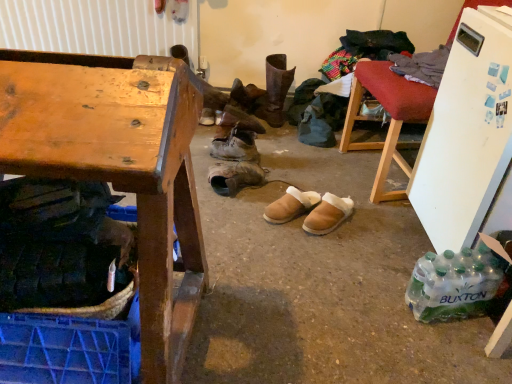
Question: Does wooden desk at left have a smaller size compared to wooden chair at upper right?

Choices:
 (A) yes
 (B) no

Answer: (B)

Question: Is wooden desk at left positioned in front of wooden chair at upper right?

Choices:
 (A) yes
 (B) no

Answer: (A)

Question: Does wooden desk at left have a greater width compared to wooden chair at upper right?

Choices:
 (A) yes
 (B) no

Answer: (A)

Question: From a real-world perspective, is wooden desk at left located higher than wooden chair at upper right?

Choices:
 (A) no
 (B) yes

Answer: (A)

Question: Is wooden desk at left surrounding wooden chair at upper right?

Choices:
 (A) yes
 (B) no

Answer: (B)

Question: From a real-world perspective, is wooden desk at left positioned above or below clear plastic bottles at lower right?

Choices:
 (A) below
 (B) above

Answer: (B)

Question: In terms of size, does wooden desk at left appear bigger or smaller than clear plastic bottles at lower right?

Choices:
 (A) big
 (B) small

Answer: (A)

Question: Is wooden desk at left in front of or behind clear plastic bottles at lower right in the image?

Choices:
 (A) behind
 (B) front

Answer: (B)

Question: Is wooden desk at left to the left or to the right of clear plastic bottles at lower right in the image?

Choices:
 (A) right
 (B) left

Answer: (B)

Question: Would you say leather boots at center, which is the third footwear in bottom-to-top order, is inside or outside leather boot at center, which is the fifth footwear from bottom to top?

Choices:
 (A) outside
 (B) inside

Answer: (A)

Question: Based on their positions, is leather boots at center, arranged as the third footwear when viewed from the top, located to the left or right of leather boot at center, which is the fifth footwear from bottom to top?

Choices:
 (A) right
 (B) left

Answer: (B)

Question: Is leather boots at center, which is the third footwear in bottom-to-top order, wider or thinner than leather boot at center, which ranks as the 1th footwear in top-to-bottom order?

Choices:
 (A) thin
 (B) wide

Answer: (A)

Question: Is leather boots at center, arranged as the third footwear when viewed from the top, in front of or behind leather boot at center, which is the fifth footwear from bottom to top, in the image?

Choices:
 (A) behind
 (B) front

Answer: (B)

Question: Which is correct: wooden desk at left is inside leather boots at center, which is the third footwear in bottom-to-top order, or outside of it?

Choices:
 (A) inside
 (B) outside

Answer: (B)

Question: From a real-world perspective, relative to leather boots at center, arranged as the third footwear when viewed from the top, is wooden desk at left vertically above or below?

Choices:
 (A) above
 (B) below

Answer: (A)